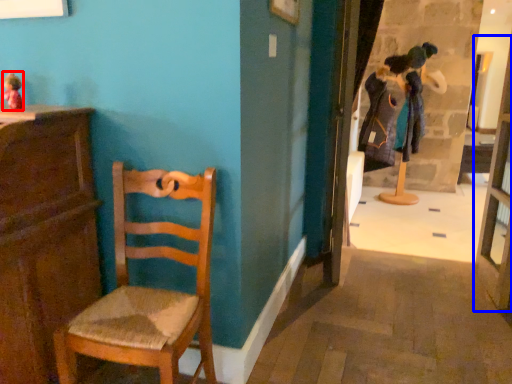
Question: Which object appears farthest to the camera in this image, toy (highlighted by a red box) or glass door (highlighted by a blue box)?

Choices:
 (A) toy
 (B) glass door

Answer: (B)